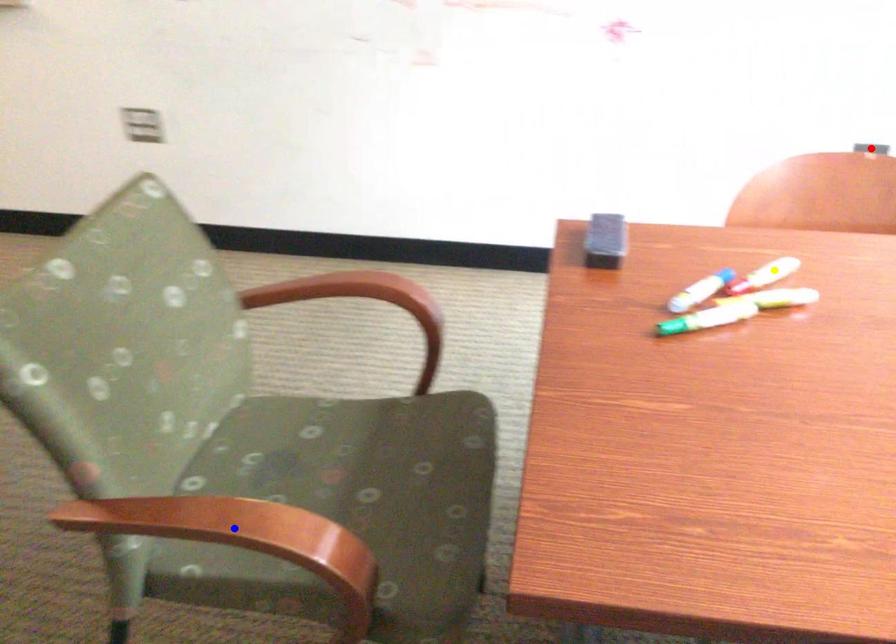
Order these from nearest to farthest:
1. yellow point
2. blue point
3. red point

blue point
yellow point
red point